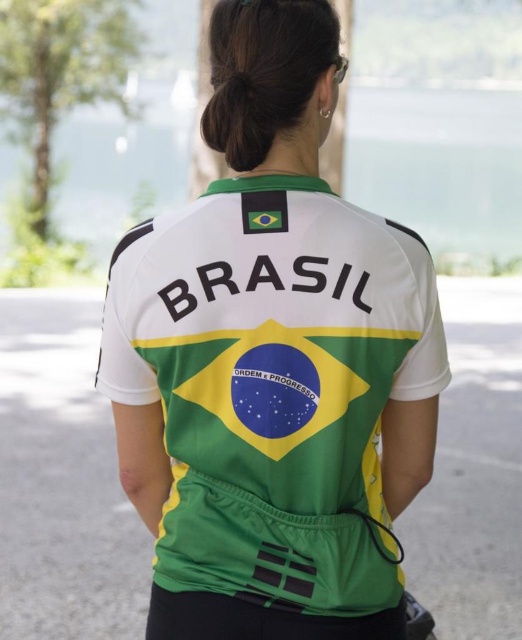
You are a photographer standing at a certain distance from the white jersey at center. You need to capture a clear photo of the jersey without any distortion. The camera you are using has a minimum focusing distance of 1.5 meters. Will you be able to take the photo successfully?

The distance between the white jersey at center and the camera is 1.43 meters, which is less than the camera minimum focusing distance of 1.5 meters. Therefore, you won photography will have distortion or be out of focus.

You are a photographer taking a picture of the back view of a person wearing a white jersey at center and black hair at upper center. Based on their sizes, which one would appear larger in the photo?

The white jersey at center is much taller than the black hair at upper center, so it would appear larger in the photo.